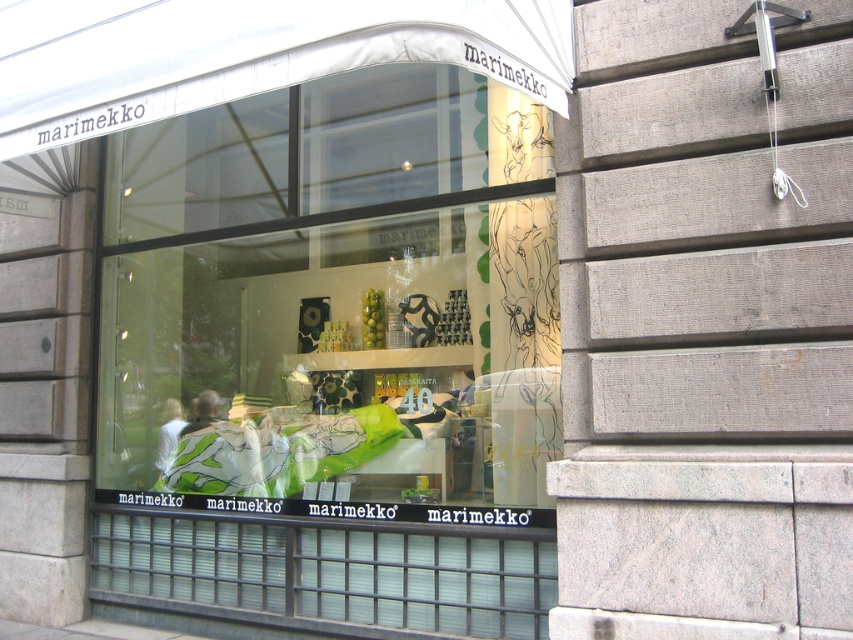
You are a customer at the Marimekko store and want to buy a smaller green fabric item. Which item should you choose between the green fabric pillows at center and the matte green fabric at center?

The matte green fabric at center is smaller in size than the green fabric pillows at center, so you should choose the matte green fabric at center.

You are standing in front of the Marimekko store and looking at the storefront. Where are the green fabric pillows at center located in the store?

A: The green fabric pillows at center are located at the center of the store, at the 2D coordinates point (341, 304).

You are a customer in the Marimekko store and want to buy a pillow. You see the green fabric pillows at center and the matte green fabric at center. Which one is on top of the other?

The green fabric pillows at center is positioned over matte green fabric at center.